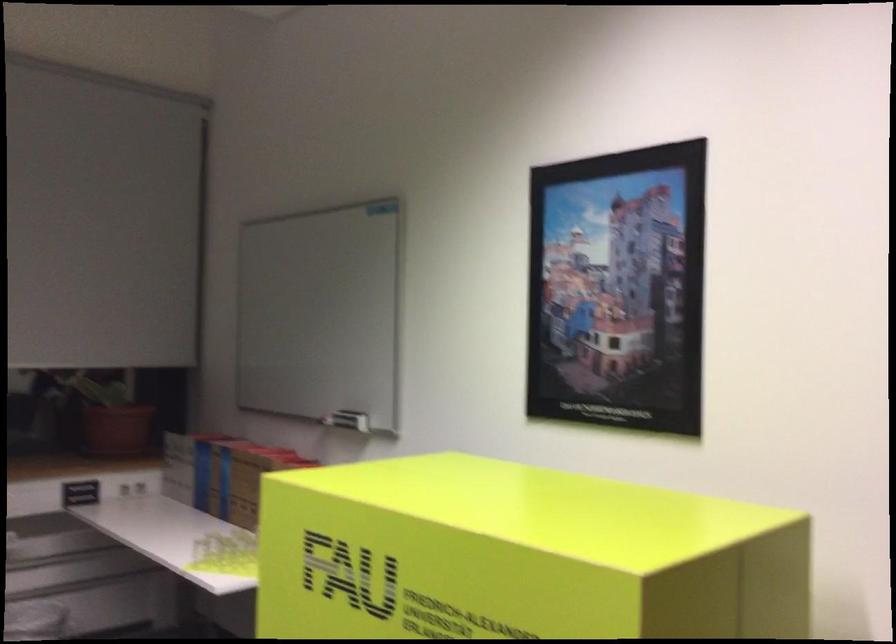
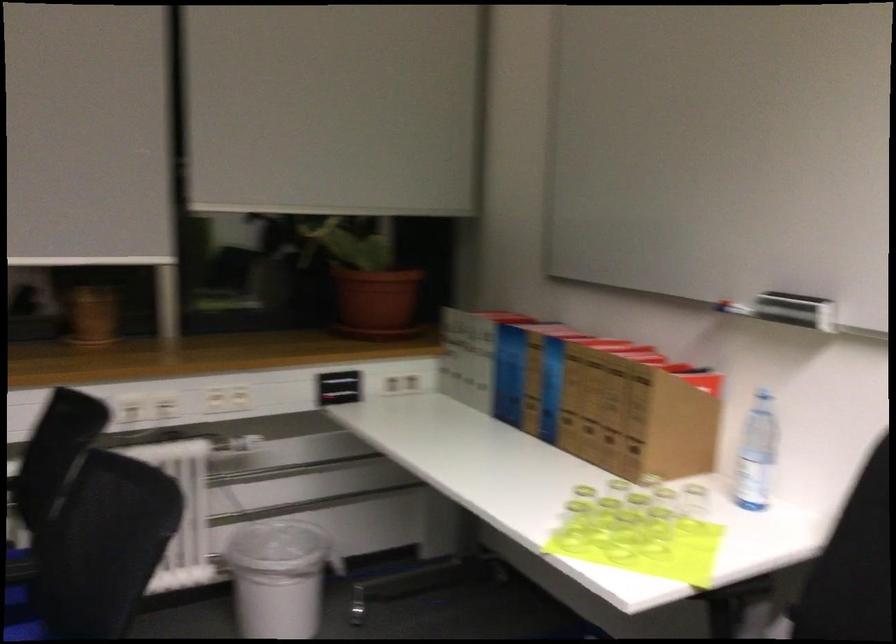
Where in the second image is the point corresponding to point 117,429 from the first image?

(375, 303)